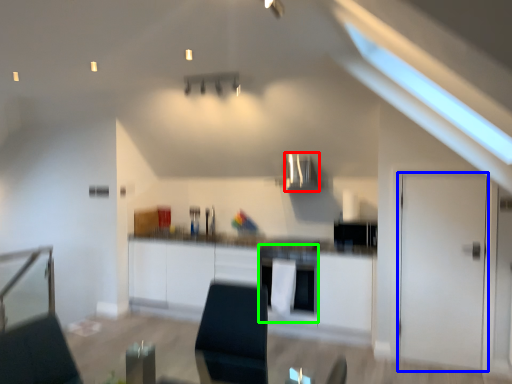
Question: Considering the real-world distances, which object is closest to exhaust hood (highlighted by a red box)? door (highlighted by a blue box) or oven (highlighted by a green box).

Choices:
 (A) door
 (B) oven

Answer: (B)